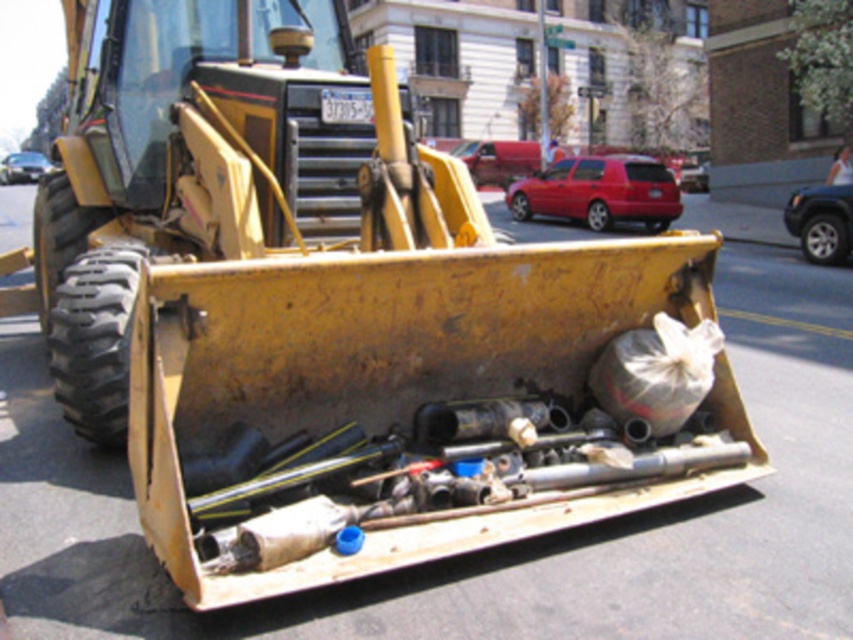
You are a delivery driver who needs to park your van between the matte red car at center and the metallic blue suv at right. Can you fit your van there if it is 6 meters long?

The matte red car at center is to the left of metallic blue suv at right, but the distance between them is not specified. Without knowing the exact spacing, it is impossible to determine if the van will fit.

Based on the photo, you are a delivery driver who needs to park your van between the matte red car at center and the metallic blue suv at right. Which vehicle should you park closer to in order to stay within the parking space limits?

The matte red car at center is closer to you than the metallic blue suv at right, so you should park closer to the metallic blue suv at right to stay within the parking space limits.